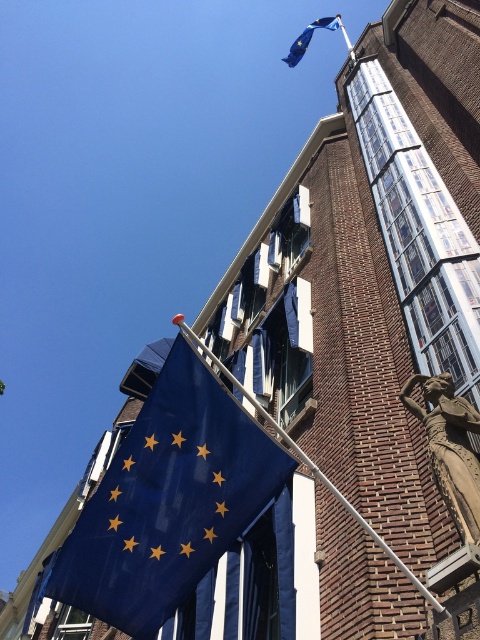
Which is below, blue matte flag at upper left or blue fabric flag at upper center?

blue matte flag at upper left is lower down.

Looking at this image, can you confirm if blue matte flag at upper left is smaller than blue fabric flag at upper center?

Indeed, blue matte flag at upper left has a smaller size compared to blue fabric flag at upper center.

At what (x,y) coordinates should I click in order to perform the action: click on blue matte flag at upper left. Please return your answer as a coordinate pair (x, y). This screenshot has height=640, width=480. Looking at the image, I should click on (168, 500).

What do you see at coordinates (168, 500) in the screenshot? The image size is (480, 640). I see `blue matte flag at upper left` at bounding box center [168, 500].

Is blue matte flag at upper left wider than metallic silver pole at lower center?

In fact, blue matte flag at upper left might be narrower than metallic silver pole at lower center.

Find the location of a particular element. This screenshot has height=640, width=480. blue matte flag at upper left is located at coordinates (168, 500).

Does metallic silver pole at lower center have a lesser width compared to blue fabric flag at upper center?

In fact, metallic silver pole at lower center might be wider than blue fabric flag at upper center.

Based on the photo, which of these two, metallic silver pole at lower center or blue fabric flag at upper center, stands taller?

Standing taller between the two is blue fabric flag at upper center.

Does point (216, 364) come behind point (299, 54)?

No, (216, 364) is closer to viewer.

Where is `metallic silver pole at lower center`? metallic silver pole at lower center is located at coordinates (311, 465).